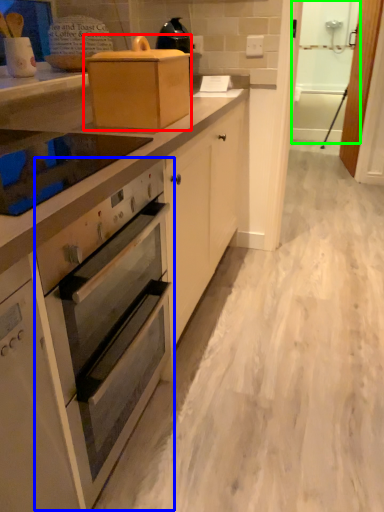
Question: Based on their relative distances, which object is nearer to appliance (highlighted by a red box)? Choose from oven (highlighted by a blue box) and screen door (highlighted by a green box).

Choices:
 (A) oven
 (B) screen door

Answer: (A)